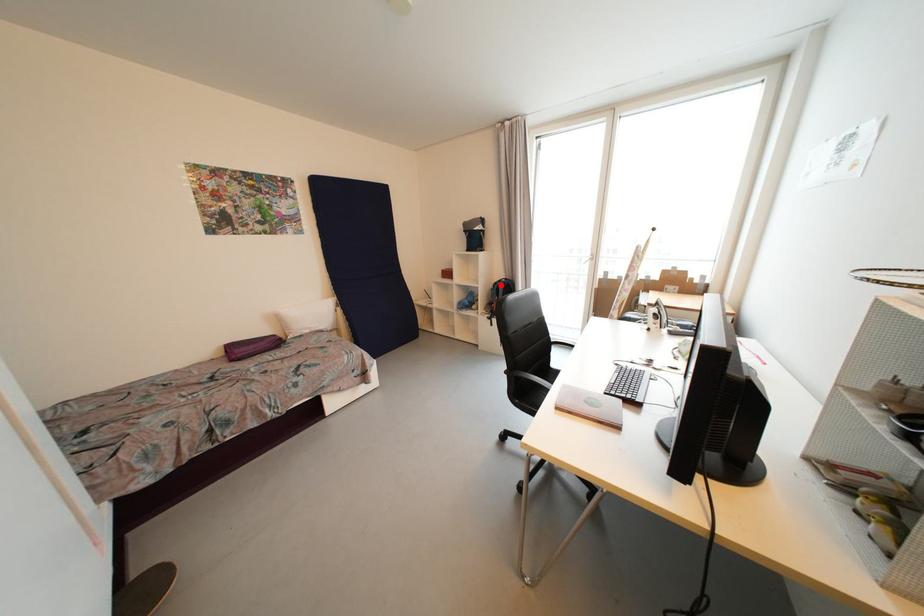
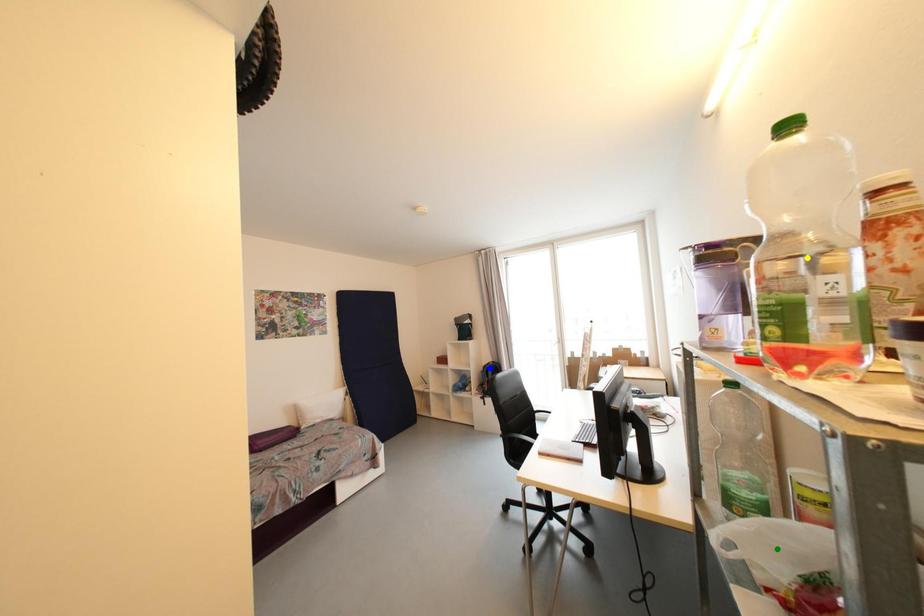
Question: I am providing you with two images of the same scene from different viewpoints. A red point is marked on the first image. You are given multiple points on the second image. Which mark in image 2 goes with the point in image 1?

Choices:
 (A) yellow point
 (B) green point
 (C) blue point

Answer: (C)